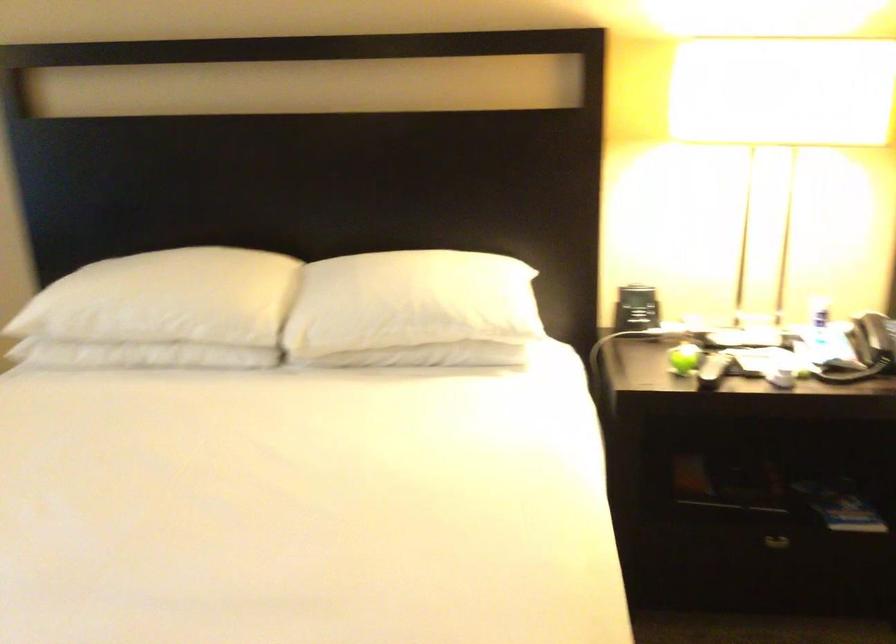
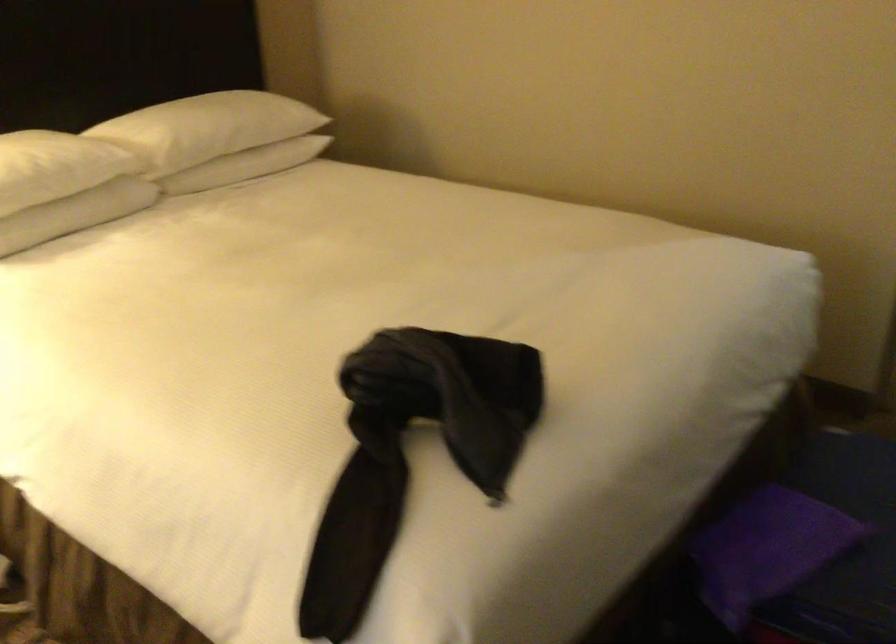
Question: How did the camera likely rotate?

Choices:
 (A) Left
 (B) Right
 (C) Up
 (D) Down

Answer: (B)